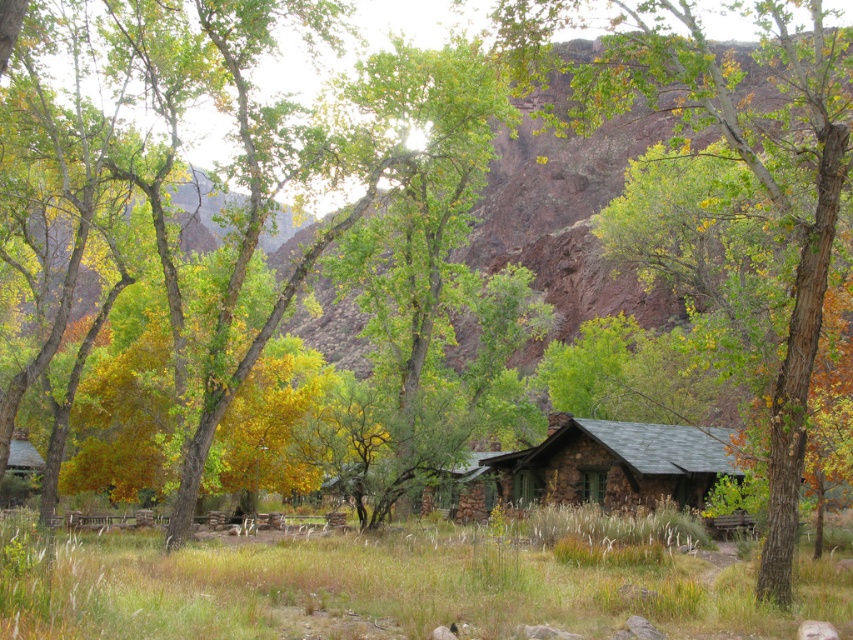
You are a hiker who wants to set up a tent in the green grass at lower center. Considering the height of the rustic stone cabin at center, will the cabin block your view of the surrounding forest when you are camping there?

The green grass at lower center is shorter than the rustic stone cabin at center. Since the grass is shorter, the cabin will block your view of the surrounding forest from the camping spot.

You are standing at the point closest to the camera in the image. Which of the two points, point (363, 593) or point (795, 154), is closer to you?

Point (363, 593) is closer to you because it is in front of point (795, 154).

You are a hiker who wants to place a tent on the green grass at lower center. Considering the green leafy tree at center, will the tree provide shade over the grass area?

The green grass at lower center is shorter than the green leafy tree at center, so the tree could potentially provide shade over the grass area depending on its canopy spread and the time of day.